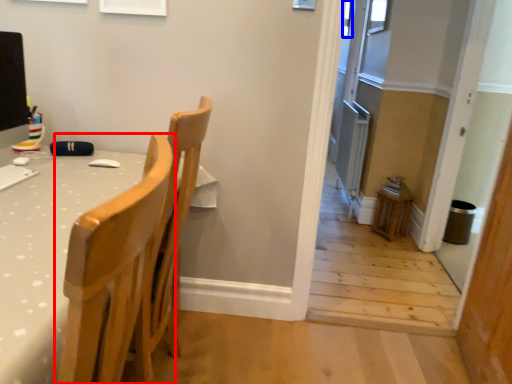
Question: Which object is closer to the camera taking this photo, chair (highlighted by a red box) or window (highlighted by a blue box)?

Choices:
 (A) chair
 (B) window

Answer: (A)